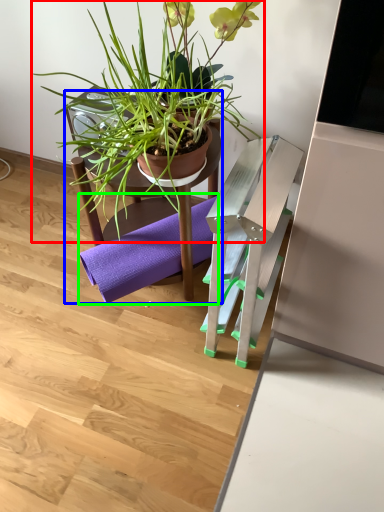
Question: Which object is the farthest from houseplant (highlighted by a red box)? Choose among these: chair (highlighted by a blue box) or yoga mat (highlighted by a green box).

Choices:
 (A) chair
 (B) yoga mat

Answer: (B)